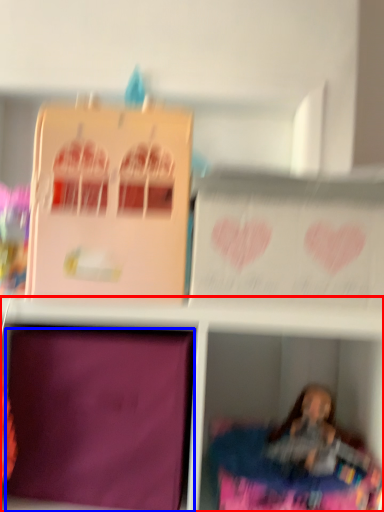
Question: Which of the following is the farthest to the observer, shelf (highlighted by a red box) or cardboard box (highlighted by a blue box)?

Choices:
 (A) shelf
 (B) cardboard box

Answer: (B)